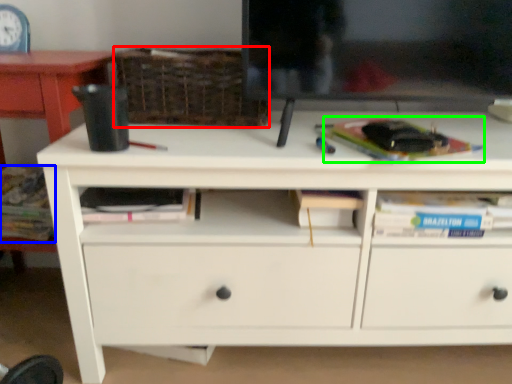
Question: Which object is positioned farthest from basket (highlighted by a red box)? Select from book (highlighted by a blue box) and paperback book (highlighted by a green box).

Choices:
 (A) book
 (B) paperback book

Answer: (A)